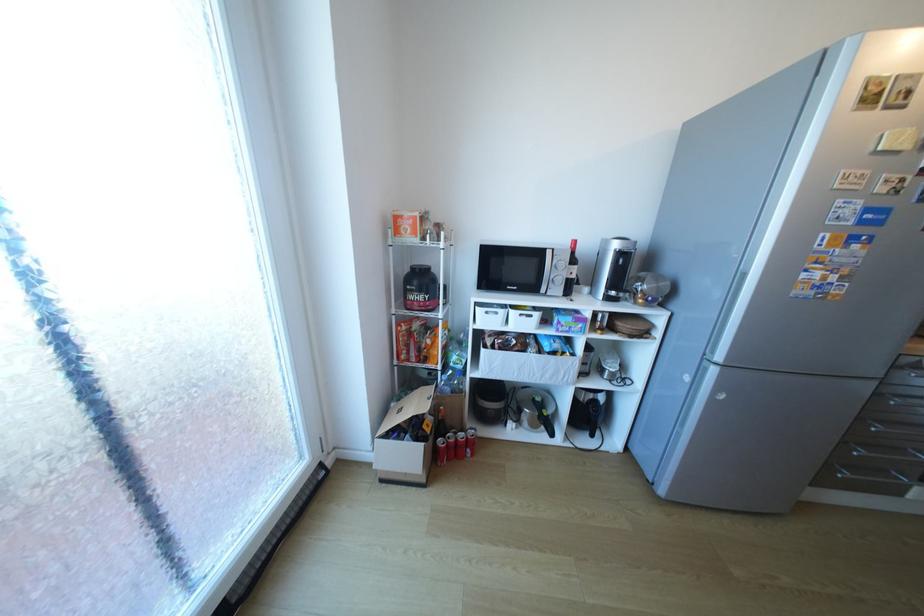
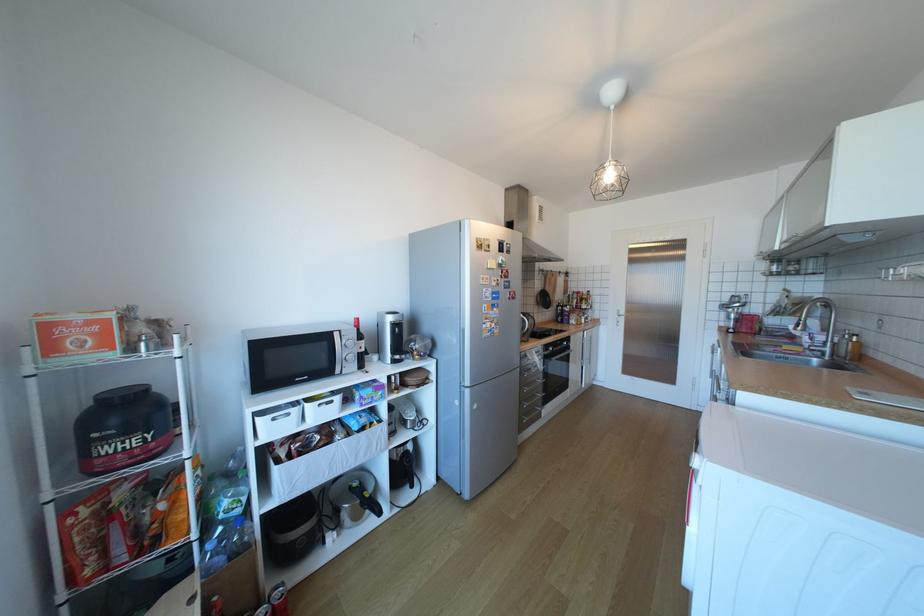
Where in the second image is the point corresponding to [433,297] from the first image?

(152, 439)